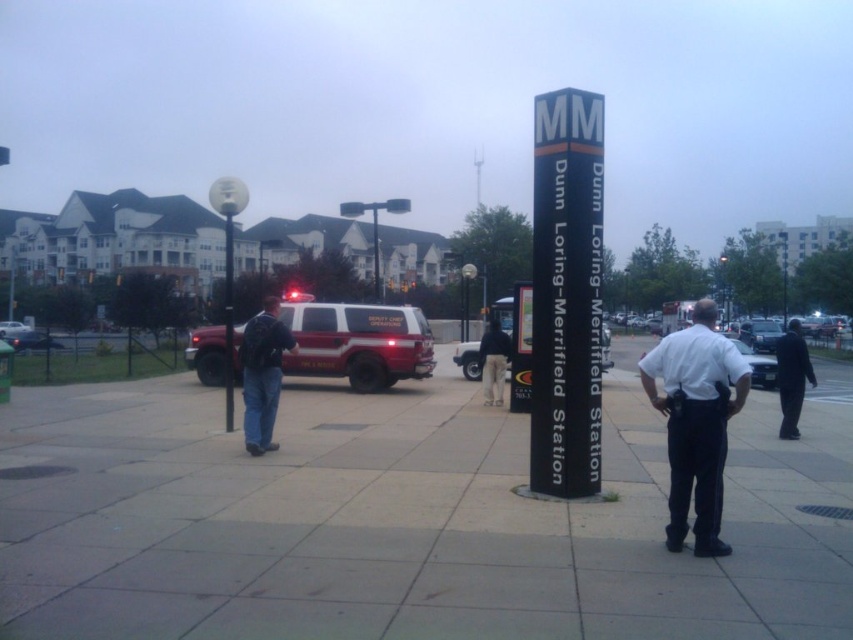
Question: Does metallic silver sedan at center have a greater width compared to metallic silver sedan at left?

Choices:
 (A) yes
 (B) no

Answer: (A)

Question: Is black smooth jacket at right below metallic silver sedan at left?

Choices:
 (A) yes
 (B) no

Answer: (A)

Question: Which point appears farthest from the camera in this image?

Choices:
 (A) click(485, 380)
 (B) click(218, 349)

Answer: (B)

Question: Which point appears farthest from the camera in this image?

Choices:
 (A) click(486, 336)
 (B) click(4, 333)
 (C) click(225, 346)

Answer: (B)

Question: Can you confirm if denim jacket at center is wider than metallic silver sedan at left?

Choices:
 (A) yes
 (B) no

Answer: (B)

Question: Which point appears farthest from the camera in this image?

Choices:
 (A) (129, 474)
 (B) (399, 323)

Answer: (B)